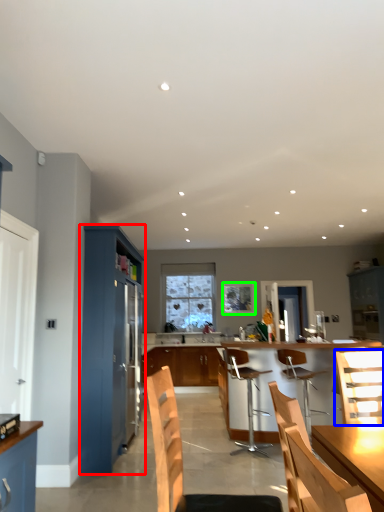
Question: Considering the real-world distances, which object is closest to cabinetry (highlighted by a red box)? chair (highlighted by a blue box) or window screen (highlighted by a green box).

Choices:
 (A) chair
 (B) window screen

Answer: (A)